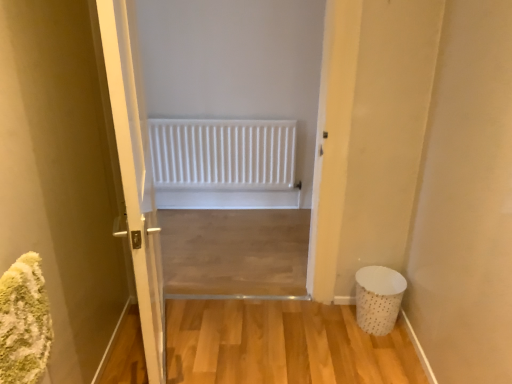
Image resolution: width=512 pixels, height=384 pixels. Find the location of `free location in front of white dotted fabric laundry basket at lower right`. free location in front of white dotted fabric laundry basket at lower right is located at coordinates (390, 343).